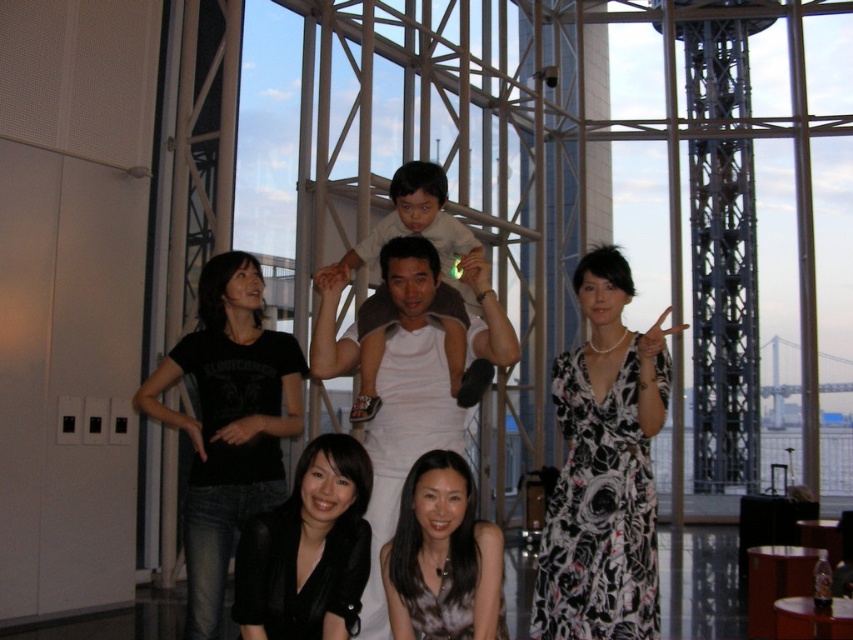
Can you confirm if white cotton tank top at center is wider than black satin dress at lower center?

Correct, the width of white cotton tank top at center exceeds that of black satin dress at lower center.

Image resolution: width=853 pixels, height=640 pixels. I want to click on white cotton tank top at center, so click(405, 404).

Which is more to the right, black cotton t-shirt at lower left or black satin dress at lower center?

black satin dress at lower center is more to the right.

Locate an element on the screen. The height and width of the screenshot is (640, 853). black cotton t-shirt at lower left is located at coordinates (228, 422).

The height and width of the screenshot is (640, 853). In order to click on black cotton t-shirt at lower left in this screenshot , I will do `click(228, 422)`.

Does black satin blouse at lower center have a lesser height compared to black satin dress at lower center?

No, black satin blouse at lower center is not shorter than black satin dress at lower center.

Is black satin blouse at lower center positioned behind black satin dress at lower center?

No, it is in front of black satin dress at lower center.

Is point (337, 556) more distant than point (392, 588)?

No.

Find the location of a particular element. The height and width of the screenshot is (640, 853). black satin blouse at lower center is located at coordinates (308, 548).